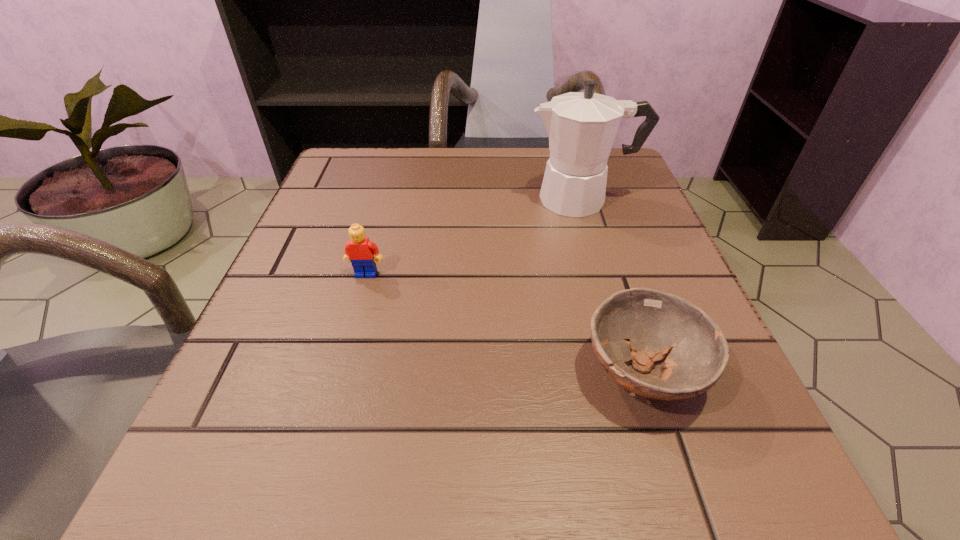
I want to click on the tallest object, so click(581, 126).

Locate an element on the screen. the farthest object is located at coordinates (581, 126).

The image size is (960, 540). What are the coordinates of `Lego` in the screenshot? It's located at (360, 251).

Image resolution: width=960 pixels, height=540 pixels. I want to click on the second farthest object, so click(x=360, y=251).

Where is `bowl`? The height and width of the screenshot is (540, 960). bowl is located at coordinates (655, 323).

Locate an element on the screen. The width and height of the screenshot is (960, 540). the shortest object is located at coordinates (655, 323).

The width and height of the screenshot is (960, 540). I want to click on free location located 0.160m at the spout of the farthest object, so click(448, 199).

The image size is (960, 540). Identify the location of free space located 0.160m at the spout of the farthest object. (448, 199).

Where is `free region located 0.230m at the spout of the farthest object`? The height and width of the screenshot is (540, 960). free region located 0.230m at the spout of the farthest object is located at coordinates (415, 199).

Locate an element on the screen. vacant area situated on the face of the second tallest object is located at coordinates (324, 425).